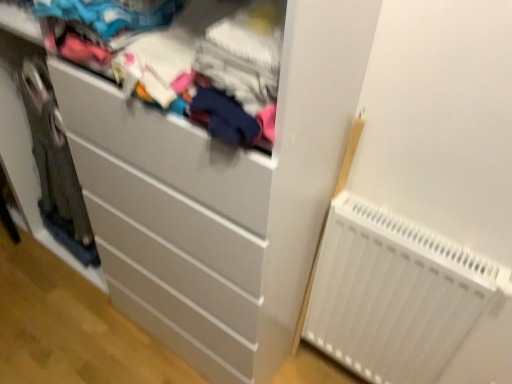
The image size is (512, 384). What do you see at coordinates (218, 198) in the screenshot?
I see `white matte chest of drawers at center` at bounding box center [218, 198].

In order to face white plastic radiator at lower right, should I rotate leftwards or rightwards?

A 16.548 degree turn to the right will do.

The height and width of the screenshot is (384, 512). What do you see at coordinates (183, 60) in the screenshot? I see `matte fabric clothes at upper center` at bounding box center [183, 60].

Where is `white matte chest of drawers at center`? This screenshot has height=384, width=512. white matte chest of drawers at center is located at coordinates (218, 198).

Is white plastic radiator at lower right aimed at matte fabric clothes at upper center?

No, white plastic radiator at lower right is not oriented towards matte fabric clothes at upper center.

Which of these two, white plastic radiator at lower right or matte fabric clothes at upper center, is bigger?

With larger size is matte fabric clothes at upper center.

Can matte fabric clothes at upper center be found inside white plastic radiator at lower right?

No, matte fabric clothes at upper center is located outside of white plastic radiator at lower right.

Between point (498, 348) and point (192, 61), which one is positioned behind?

The point (498, 348) is farther from the camera.

Looking at the image, does matte fabric clothes at upper center seem bigger or smaller compared to white matte chest of drawers at center?

In the image, matte fabric clothes at upper center appears to be smaller than white matte chest of drawers at center.

You are a GUI agent. You are given a task and a screenshot of the screen. Output one action in this format:
    pyautogui.click(x=<x>, y=<y>)
    Task: Click on the clothing above the white matte chest of drawers at center (from a real-world perspective)
    This screenshot has height=384, width=512.
    Given the screenshot: What is the action you would take?
    pyautogui.click(x=183, y=60)

Is matte fabric clothes at upper center not within white matte chest of drawers at center?

No, matte fabric clothes at upper center is not outside of white matte chest of drawers at center.

From a real-world perspective, is matte fabric clothes at upper center positioned over white matte chest of drawers at center based on gravity?

Yes, from a real-world perspective, matte fabric clothes at upper center is above white matte chest of drawers at center.

Is white matte chest of drawers at center facing away from white plastic radiator at lower right?

No, white matte chest of drawers at center's orientation is not away from white plastic radiator at lower right.

Based on the photo, from the image's perspective, is white matte chest of drawers at center above or below white plastic radiator at lower right?

white matte chest of drawers at center is above white plastic radiator at lower right.

The width and height of the screenshot is (512, 384). I want to click on the chest of drawers that appears above the white plastic radiator at lower right (from the image's perspective), so click(x=218, y=198).

Considering the sizes of white matte chest of drawers at center and white plastic radiator at lower right in the image, is white matte chest of drawers at center taller or shorter than white plastic radiator at lower right?

Considering their sizes, white matte chest of drawers at center has more height than white plastic radiator at lower right.

From the image's perspective, which one is positioned higher, matte fabric clothes at upper center or white plastic radiator at lower right?

matte fabric clothes at upper center is shown above in the image.

Between matte fabric clothes at upper center and white plastic radiator at lower right, which one appears on the left side from the viewer's perspective?

matte fabric clothes at upper center.

Does matte fabric clothes at upper center turn towards white plastic radiator at lower right?

No, matte fabric clothes at upper center does not turn towards white plastic radiator at lower right.

Can you tell me how much matte fabric clothes at upper center and white plastic radiator at lower right differ in facing direction?

The facing directions of matte fabric clothes at upper center and white plastic radiator at lower right are 0.00155 degrees apart.

The width and height of the screenshot is (512, 384). In the image, there is a matte fabric clothes at upper center. Identify the location of the chest of drawers below it (from a real-world perspective). (218, 198).

Is matte fabric clothes at upper center inside white matte chest of drawers at center?

Absolutely, matte fabric clothes at upper center is inside white matte chest of drawers at center.

From the picture: Between white matte chest of drawers at center and matte fabric clothes at upper center, which one has less height?

matte fabric clothes at upper center.

In order to click on chest of drawers that appears on the left of white plastic radiator at lower right in this screenshot , I will do `click(218, 198)`.

Considering the relative sizes of white plastic radiator at lower right and white matte chest of drawers at center in the image provided, is white plastic radiator at lower right thinner than white matte chest of drawers at center?

Correct, the width of white plastic radiator at lower right is less than that of white matte chest of drawers at center.

Is point (347, 305) less distant than point (196, 160)?

No, (347, 305) is further to viewer.

Find the location of a particular element. The width and height of the screenshot is (512, 384). clothing located on the left of white plastic radiator at lower right is located at coordinates (183, 60).

This screenshot has width=512, height=384. What are the coordinates of `clothing in front of the white matte chest of drawers at center` in the screenshot? It's located at (183, 60).

From the image, which object appears to be farther from white matte chest of drawers at center, matte fabric clothes at upper center or white plastic radiator at lower right?

white plastic radiator at lower right is further to white matte chest of drawers at center.

Based on their spatial positions, is white matte chest of drawers at center or matte fabric clothes at upper center closer to white plastic radiator at lower right?

Based on the image, white matte chest of drawers at center appears to be nearer to white plastic radiator at lower right.

Looking at the image, which one is located closer to matte fabric clothes at upper center, white plastic radiator at lower right or white matte chest of drawers at center?

Based on the image, white matte chest of drawers at center appears to be nearer to matte fabric clothes at upper center.

Estimate the real-world distances between objects in this image. Which object is further from matte fabric clothes at upper center, white matte chest of drawers at center or white plastic radiator at lower right?

Based on the image, white plastic radiator at lower right appears to be further to matte fabric clothes at upper center.

Based on their spatial positions, is white plastic radiator at lower right or matte fabric clothes at upper center closer to white matte chest of drawers at center?

matte fabric clothes at upper center lies closer to white matte chest of drawers at center than the other object.

Which object lies nearer to the anchor point white plastic radiator at lower right, matte fabric clothes at upper center or white matte chest of drawers at center?

The object closer to white plastic radiator at lower right is white matte chest of drawers at center.

Locate an element on the screen. This screenshot has height=384, width=512. clothing between white matte chest of drawers at center and white plastic radiator at lower right from left to right is located at coordinates (183, 60).